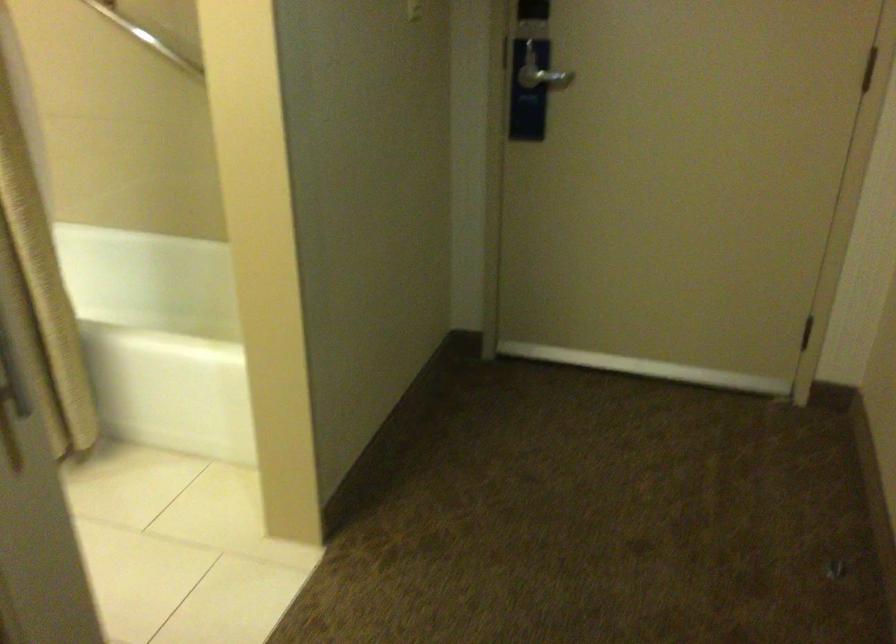
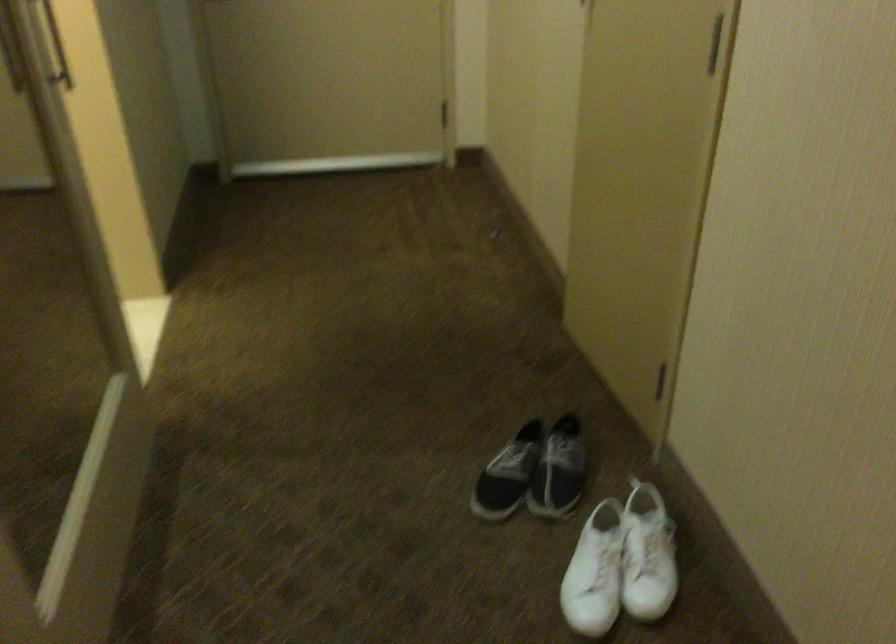
What movement of the cameraman would produce the second image?

The cameraman walked toward left, backward.